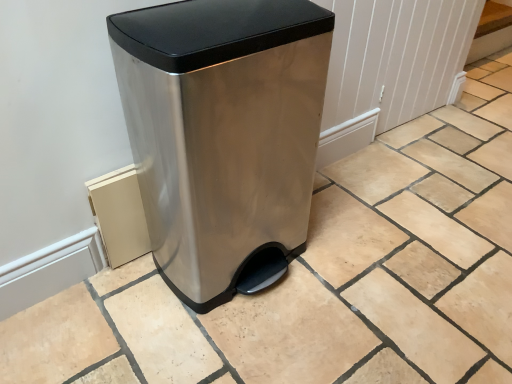
Identify the location of unoccupied area in front of stainless steel trash can at center. This screenshot has width=512, height=384. (237, 344).